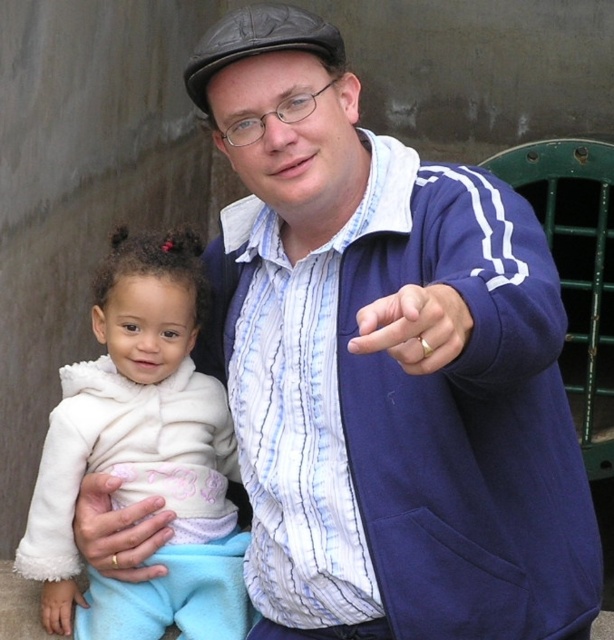
Question: Based on their relative distances, which object is farther from the white fluffy coat at left?

Choices:
 (A) gold ring at lower left
 (B) blue fleece jacket at center

Answer: (B)

Question: Is white fluffy coat at left below gold ring at center?

Choices:
 (A) no
 (B) yes

Answer: (B)

Question: Is gold ring at center smaller than gold ring at lower left?

Choices:
 (A) no
 (B) yes

Answer: (B)

Question: Does white fluffy coat at left come behind gold ring at lower left?

Choices:
 (A) no
 (B) yes

Answer: (B)

Question: Among these objects, which one is nearest to the camera?

Choices:
 (A) gold ring at lower left
 (B) white fluffy coat at left

Answer: (A)

Question: Which point appears farthest from the camera in this image?

Choices:
 (A) (332, 294)
 (B) (440, 317)

Answer: (A)